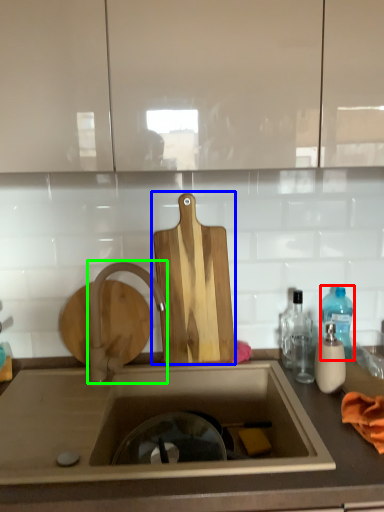
Question: Which object is positioned farthest from bottle (highlighted by a red box)? Select from cutting board (highlighted by a blue box) and tap (highlighted by a green box).

Choices:
 (A) cutting board
 (B) tap

Answer: (B)